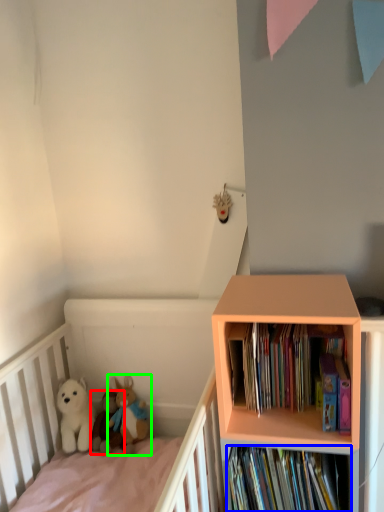
Question: Considering the real-world distances, which object is closest to toy (highlighted by a red box)? book (highlighted by a blue box) or toy (highlighted by a green box).

Choices:
 (A) book
 (B) toy

Answer: (B)